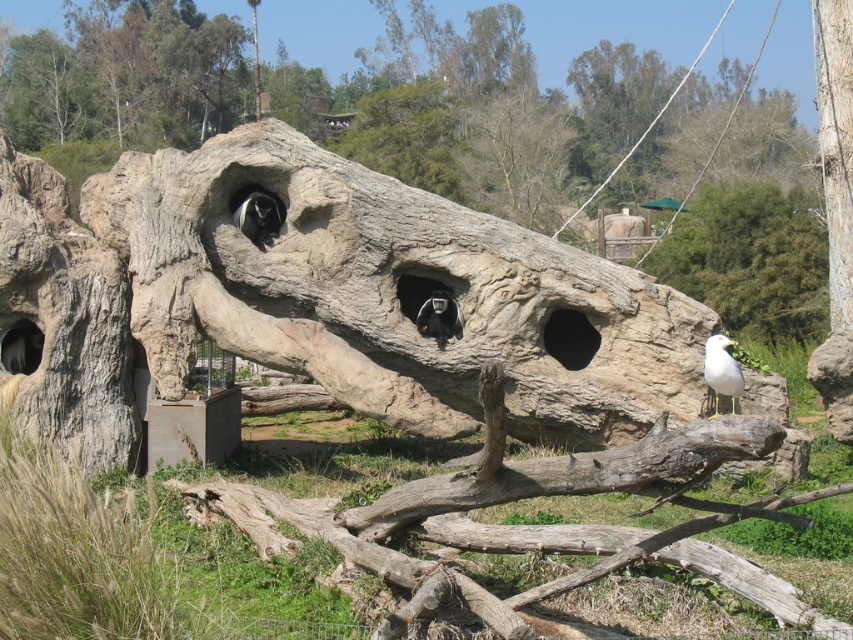
Which is in front, point (776, 189) or point (815, 51)?

Positioned in front is point (776, 189).

Is point (703, 227) positioned in front of point (833, 301)?

No, (703, 227) is behind (833, 301).

I want to click on smooth bark tree trunk at center, so click(750, 260).

Between rough bark tree trunk at upper right and white feathered bird at lower right, which one is positioned higher?

rough bark tree trunk at upper right is above.

Is point (833, 131) closer to camera compared to point (724, 365)?

No, it is behind (724, 365).

The width and height of the screenshot is (853, 640). I want to click on rough bark tree trunk at upper right, so click(836, 147).

Does black smooth hole at center have a greater height compared to black fur monkey at center?

Yes.

Image resolution: width=853 pixels, height=640 pixels. Identify the location of black smooth hole at center. (570, 339).

What are the coordinates of `black smooth hole at center` in the screenshot? It's located at (570, 339).